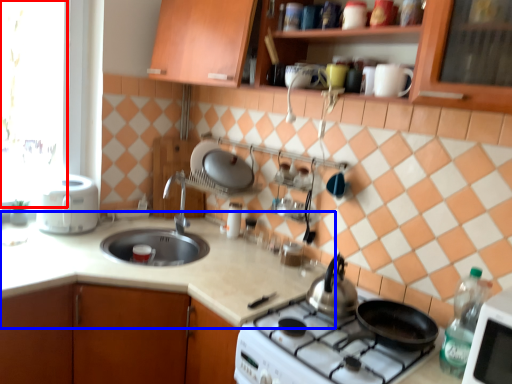
Question: Which of the following is the closest to the observer, window screen (highlighted by a red box) or countertop (highlighted by a blue box)?

Choices:
 (A) window screen
 (B) countertop

Answer: (B)